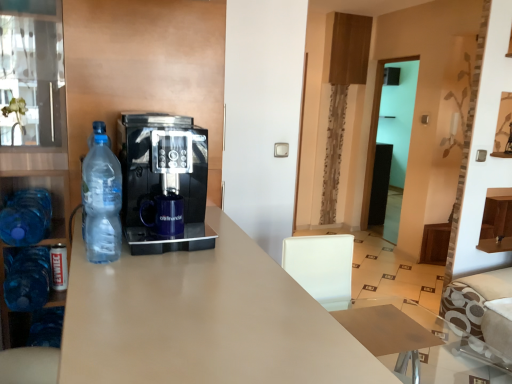
The width and height of the screenshot is (512, 384). What are the coordinates of `blue plastic bottle at lower left, acting as the first bottle starting from the bottom` in the screenshot? It's located at (28, 280).

What are the coordinates of `blue glass cabinet at left` in the screenshot? It's located at (34, 105).

This screenshot has width=512, height=384. What do you see at coordinates (414, 340) in the screenshot?
I see `transparent glass table at lower right` at bounding box center [414, 340].

Describe the element at coordinates (26, 217) in the screenshot. I see `blue plastic bottle at left, which is the 2th bottle in top-to-bottom order` at that location.

Image resolution: width=512 pixels, height=384 pixels. What do you see at coordinates (102, 202) in the screenshot?
I see `clear plastic bottle at left, marked as the third bottle in a left-to-right arrangement` at bounding box center [102, 202].

Locate an element on the screen. blue plastic bottle at lower left, which is the third bottle in front-to-back order is located at coordinates (28, 280).

Looking at their sizes, would you say clear plastic bottle at left, marked as the first bottle in a front-to-back arrangement, is wider or thinner than blue plastic bottle at left, placed as the 2th bottle when sorted from back to front?

Considering their sizes, clear plastic bottle at left, marked as the first bottle in a front-to-back arrangement, looks slimmer than blue plastic bottle at left, placed as the 2th bottle when sorted from back to front.

Considering the positions of points (104, 137) and (38, 205), is point (104, 137) farther from camera compared to point (38, 205)?

No, (104, 137) is closer to viewer.

Is clear plastic bottle at left, the third bottle from the bottom, next to blue plastic bottle at left, which is the 2th bottle in top-to-bottom order, and touching it?

They are not placed beside each other.

Is clear plastic bottle at left, marked as the first bottle in a front-to-back arrangement, bigger or smaller than blue plastic bottle at left, the 2th bottle viewed from the right?

clear plastic bottle at left, marked as the first bottle in a front-to-back arrangement, is smaller than blue plastic bottle at left, the 2th bottle viewed from the right.

Find the location of a particular element. This screenshot has width=512, height=384. desk directly beneath the blue glass cabinet at left (from a real-world perspective) is located at coordinates (203, 320).

Considering the sizes of objects matte beige desk at center and blue glass cabinet at left in the image provided, who is thinner, matte beige desk at center or blue glass cabinet at left?

blue glass cabinet at left is thinner.

Which object is positioned more to the left, matte beige desk at center or blue glass cabinet at left?

Positioned to the left is blue glass cabinet at left.

Looking at this image, does blue plastic bottle at left, which is the 2th bottle in top-to-bottom order, turn towards blue glass cabinet at left?

No, blue plastic bottle at left, which is the 2th bottle in top-to-bottom order, is not oriented towards blue glass cabinet at left.

Based on the photo, which of these two, blue plastic bottle at left, which is the 2th bottle from front to back, or blue glass cabinet at left, stands shorter?

blue plastic bottle at left, which is the 2th bottle from front to back, is shorter.

Considering the relative positions of blue plastic bottle at left, which is the 2th bottle from front to back, and blue glass cabinet at left in the image provided, is blue plastic bottle at left, which is the 2th bottle from front to back, to the left of blue glass cabinet at left from the viewer's perspective?

No, blue plastic bottle at left, which is the 2th bottle from front to back, is not to the left of blue glass cabinet at left.

Do you think clear plastic bottle at left, marked as the third bottle in a left-to-right arrangement, is within transparent glass table at lower right, or outside of it?

clear plastic bottle at left, marked as the third bottle in a left-to-right arrangement, is spatially situated outside transparent glass table at lower right.

Can you see clear plastic bottle at left, the third bottle from the bottom, touching transparent glass table at lower right?

No, clear plastic bottle at left, the third bottle from the bottom, is not in contact with transparent glass table at lower right.

Is clear plastic bottle at left, the third bottle from the bottom, looking in the opposite direction of transparent glass table at lower right?

That's not correct — clear plastic bottle at left, the third bottle from the bottom, is not looking away from transparent glass table at lower right.

Is clear plastic bottle at left, which is the third bottle in back-to-front order, bigger or smaller than transparent glass table at lower right?

Clearly, clear plastic bottle at left, which is the third bottle in back-to-front order, is smaller in size than transparent glass table at lower right.

From their relative heights in the image, would you say transparent glass door at center is taller or shorter than blue plastic bottle at left, which is the 2th bottle from front to back?

Considering their sizes, transparent glass door at center has more height than blue plastic bottle at left, which is the 2th bottle from front to back.

Is transparent glass door at center placed right next to blue plastic bottle at left, marked as the second bottle in a left-to-right arrangement?

transparent glass door at center and blue plastic bottle at left, marked as the second bottle in a left-to-right arrangement, are not in contact.

Does point (368, 177) appear closer or farther from the camera than point (5, 238)?

Point (368, 177) is positioned farther from the camera compared to point (5, 238).

Is transparent glass door at center behind blue plastic bottle at left, placed as the 2th bottle when sorted from back to front?

Yes, transparent glass door at center is behind blue plastic bottle at left, placed as the 2th bottle when sorted from back to front.

Does blue plastic bottle at left, which is the second bottle from bottom to top, have a smaller size compared to transparent glass door at center?

Correct, blue plastic bottle at left, which is the second bottle from bottom to top, occupies less space than transparent glass door at center.

Is blue plastic bottle at left, marked as the second bottle in a left-to-right arrangement, placed right next to transparent glass door at center?

No, blue plastic bottle at left, marked as the second bottle in a left-to-right arrangement, is not touching transparent glass door at center.

Which of these two, matte beige desk at center or blue plastic bottle at lower left, which is the first bottle in back-to-front order, stands taller?

matte beige desk at center is taller.

Is blue plastic bottle at lower left, acting as the 3th bottle starting from the top, surrounded by matte beige desk at center?

No, blue plastic bottle at lower left, acting as the 3th bottle starting from the top, is not surrounded by matte beige desk at center.

Considering the relative positions of matte beige desk at center and blue plastic bottle at lower left, the third bottle when ordered from right to left, in the image provided, is matte beige desk at center to the right of blue plastic bottle at lower left, the third bottle when ordered from right to left, from the viewer's perspective?

Indeed, matte beige desk at center is positioned on the right side of blue plastic bottle at lower left, the third bottle when ordered from right to left.

Based on the photo, from a real-world perspective, between matte beige desk at center and blue plastic bottle at lower left, positioned as the 1th bottle in left-to-right order, who is vertically lower?

matte beige desk at center.

I want to click on bottle in front of the blue plastic bottle at left, which is the 2th bottle in top-to-bottom order, so [102, 202].

Locate an element on the screen. This screenshot has height=384, width=512. desk below the blue glass cabinet at left (from the image's perspective) is located at coordinates (203, 320).

Estimate the real-world distances between objects in this image. Which object is further from matte beige desk at center, blue plastic bottle at left, which is the 2th bottle from front to back, or transparent glass table at lower right?

transparent glass table at lower right lies further to matte beige desk at center than the other object.

Which object lies further to the anchor point blue plastic bottle at left, which is the 2th bottle from front to back, transparent glass door at center or matte beige desk at center?

The object further to blue plastic bottle at left, which is the 2th bottle from front to back, is transparent glass door at center.

Estimate the real-world distances between objects in this image. Which object is closer to transparent glass table at lower right, blue glass cabinet at left or blue plastic bottle at left, which is the 2th bottle from front to back?

Based on the image, blue plastic bottle at left, which is the 2th bottle from front to back, appears to be nearer to transparent glass table at lower right.

When comparing their distances from transparent glass table at lower right, does clear plastic bottle at left, marked as the third bottle in a left-to-right arrangement, or blue plastic bottle at lower left, acting as the 3th bottle starting from the top, seem closer?

clear plastic bottle at left, marked as the third bottle in a left-to-right arrangement, lies closer to transparent glass table at lower right than the other object.

Estimate the real-world distances between objects in this image. Which object is closer to clear plastic bottle at left, which is counted as the first bottle, starting from the right, blue plastic bottle at lower left, acting as the 3th bottle starting from the top, or transparent glass table at lower right?

blue plastic bottle at lower left, acting as the 3th bottle starting from the top, is positioned closer to the anchor clear plastic bottle at left, which is counted as the first bottle, starting from the right.

Looking at the image, which one is located closer to blue plastic bottle at left, which is the 2th bottle in top-to-bottom order, blue glass cabinet at left or transparent glass door at center?

The object closer to blue plastic bottle at left, which is the 2th bottle in top-to-bottom order, is blue glass cabinet at left.

Looking at the image, which one is located further to matte beige desk at center, blue plastic bottle at left, which is the second bottle from bottom to top, or clear plastic bottle at left, the third bottle from the bottom?

blue plastic bottle at left, which is the second bottle from bottom to top, is further to matte beige desk at center.

Which object lies nearer to the anchor point matte beige desk at center, blue plastic bottle at left, which is the second bottle from bottom to top, or transparent glass door at center?

blue plastic bottle at left, which is the second bottle from bottom to top, is closer to matte beige desk at center.

Find the location of `desk between blue plastic bottle at left, the 2th bottle viewed from the right, and transparent glass table at lower right, in the horizontal direction`. desk between blue plastic bottle at left, the 2th bottle viewed from the right, and transparent glass table at lower right, in the horizontal direction is located at coordinates (203, 320).

Where is `bottle between blue glass cabinet at left and blue plastic bottle at lower left, acting as the 3th bottle starting from the top, in the vertical direction`? Image resolution: width=512 pixels, height=384 pixels. bottle between blue glass cabinet at left and blue plastic bottle at lower left, acting as the 3th bottle starting from the top, in the vertical direction is located at coordinates tap(26, 217).

Where is `table located between matte beige desk at center and transparent glass door at center in the depth direction`? table located between matte beige desk at center and transparent glass door at center in the depth direction is located at coordinates (414, 340).

The image size is (512, 384). In order to click on table positioned between clear plastic bottle at left, the third bottle from the bottom, and transparent glass door at center from near to far in this screenshot , I will do `click(414, 340)`.